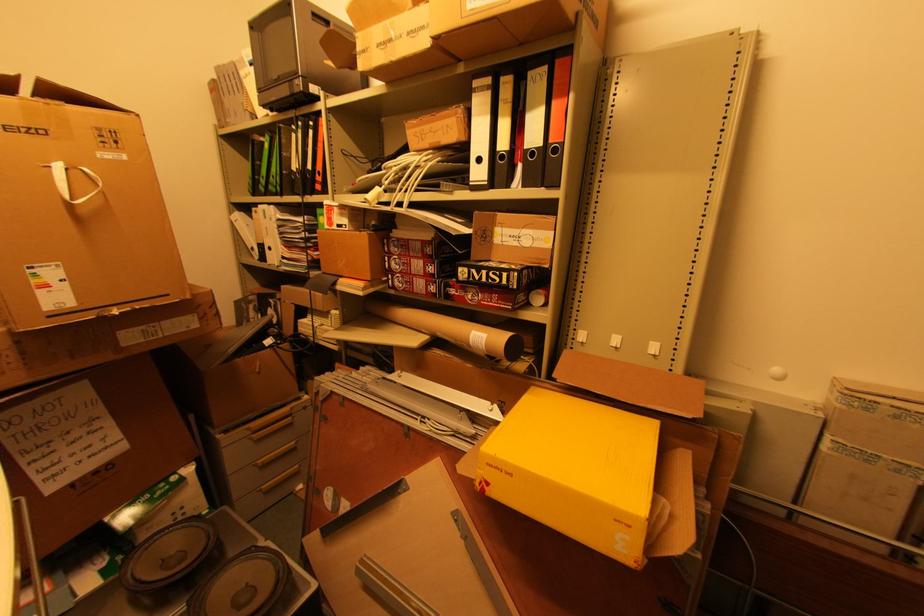
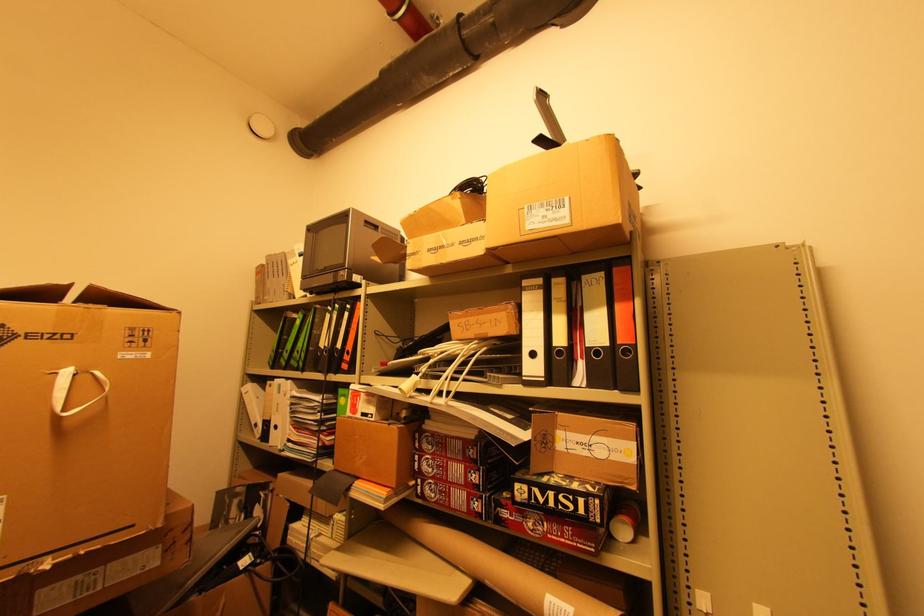
Where in the second image is the point corresponding to [45,132] from the first image?

(70, 338)